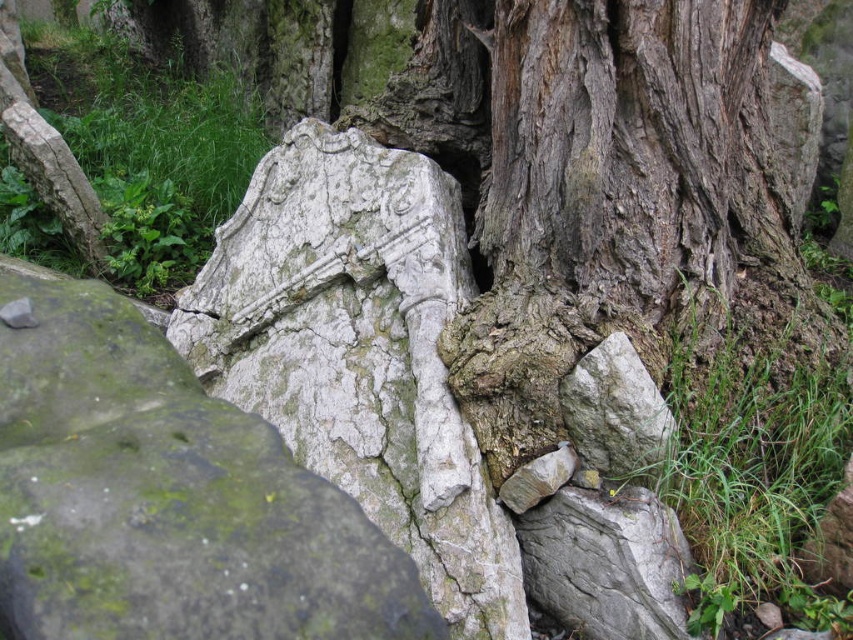
Question: Which object appears closest to the camera in this image?

Choices:
 (A) gray rough bark tree trunk at center
 (B) gray rough rock at center
 (C) weathered stone at center
 (D) white cracked stone at center

Answer: (C)

Question: Can you confirm if weathered stone at center is bigger than gray rough rock at center?

Choices:
 (A) no
 (B) yes

Answer: (B)

Question: From the image, what is the correct spatial relationship of weathered stone at center in relation to gray rough rock at center?

Choices:
 (A) above
 (B) below

Answer: (A)

Question: Which point is farther to the camera?

Choices:
 (A) gray rough rock at center
 (B) white cracked stone at center

Answer: (A)

Question: Among these objects, which one is nearest to the camera?

Choices:
 (A) gray rough bark tree trunk at center
 (B) gray rough rock at center
 (C) weathered stone at center

Answer: (C)

Question: Does gray rough bark tree trunk at center appear under white cracked stone at center?

Choices:
 (A) no
 (B) yes

Answer: (A)